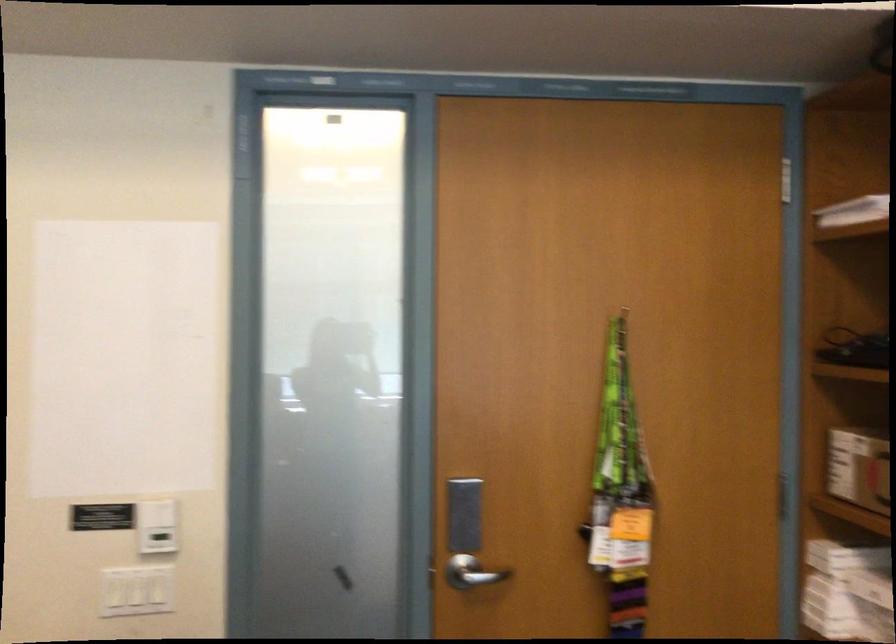
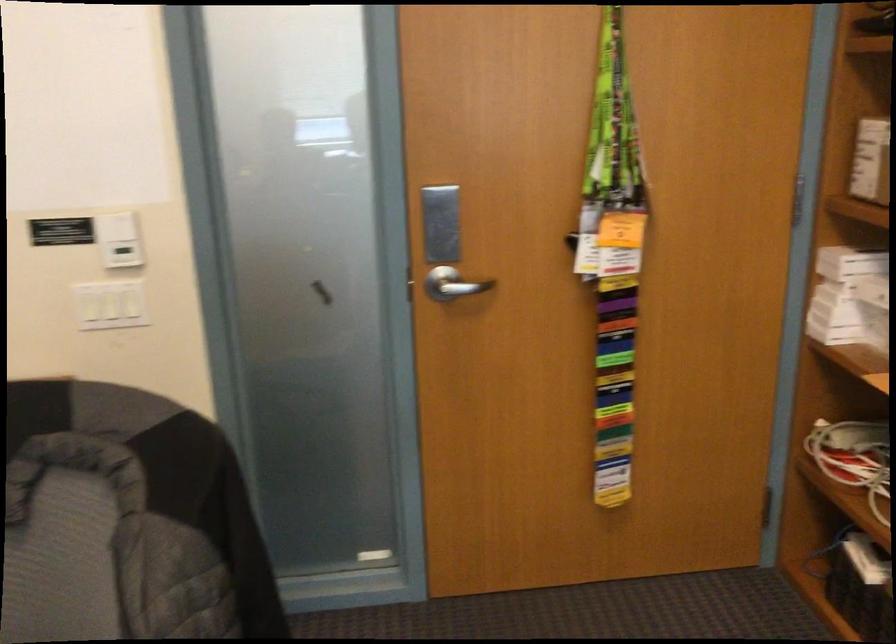
Locate, in the second image, the point that corresponds to (159,507) in the first image.

(116, 225)